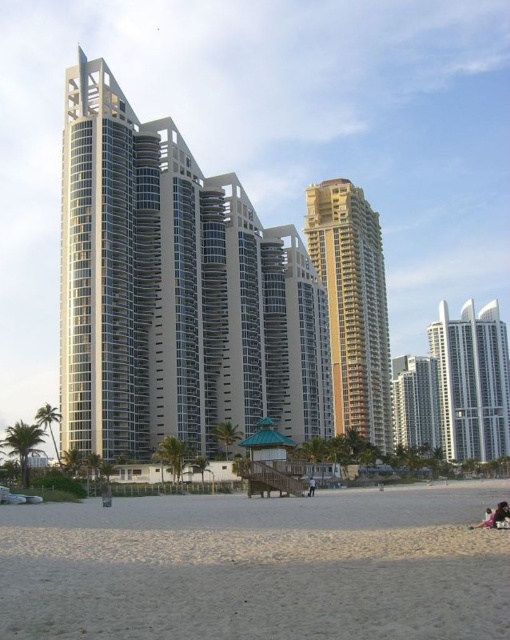
Question: Based on their relative distances, which object is farther from the white sand at lower center?

Choices:
 (A) dark blue jeans at center
 (B) gold textured building at center
 (C) smooth glass building at center
 (D) white smooth building at right

Answer: (D)

Question: Among these points, which one is nearest to the camera?

Choices:
 (A) (421, 419)
 (B) (131, 324)
 (C) (452, 342)
 (D) (368, 330)

Answer: (B)

Question: Is beige glass building at center bigger than white sand at lower center?

Choices:
 (A) no
 (B) yes

Answer: (B)

Question: Is beige glass building at center further to camera compared to gold textured building at center?

Choices:
 (A) no
 (B) yes

Answer: (A)

Question: Is gold textured building at center thinner than smooth glass building at center?

Choices:
 (A) yes
 (B) no

Answer: (A)

Question: Which of these objects is positioned closest to the gold textured building at center?

Choices:
 (A) beige glass building at center
 (B) smooth glass building at center
 (C) white smooth building at right

Answer: (A)